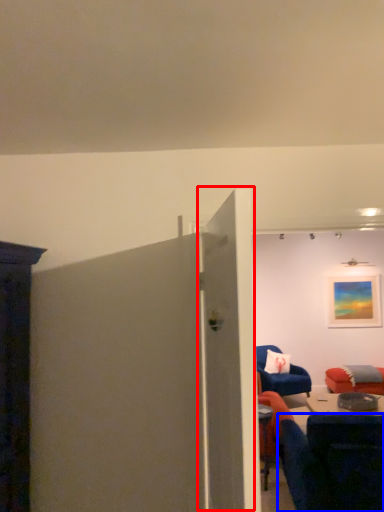
Question: Which point is closer to the camera, door (highlighted by a red box) or chair (highlighted by a blue box)?

Choices:
 (A) door
 (B) chair

Answer: (A)